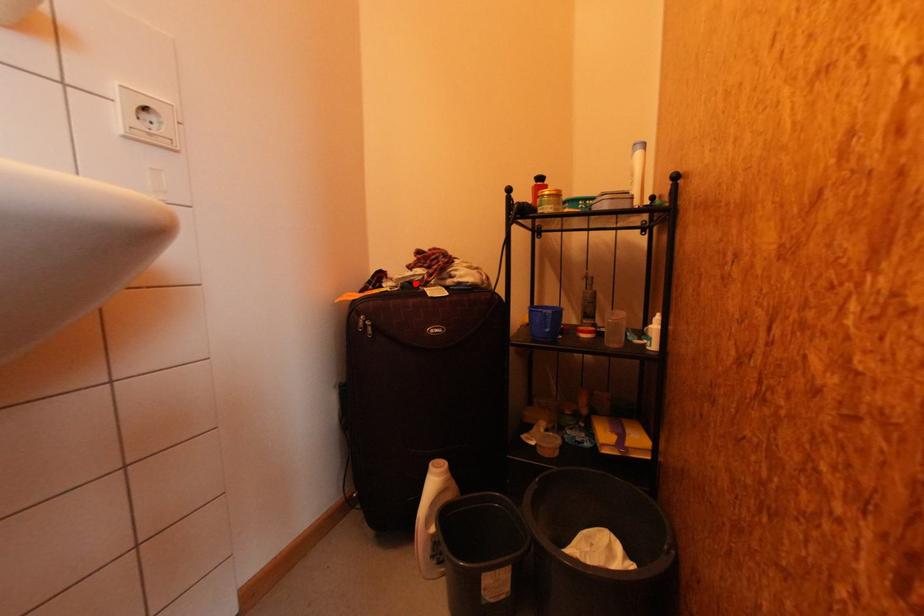
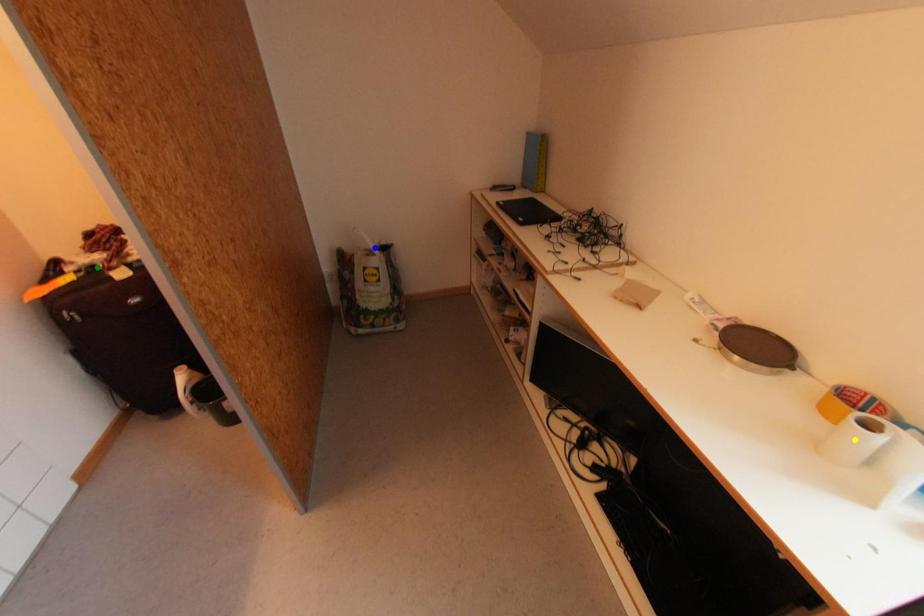
Question: I am providing you with two images of the same scene from different viewpoints. A red point is marked on the first image. You are given multiple points on the second image. Which spot in image 2 lines up with the point in image 1?

Choices:
 (A) blue point
 (B) yellow point
 (C) green point

Answer: (C)